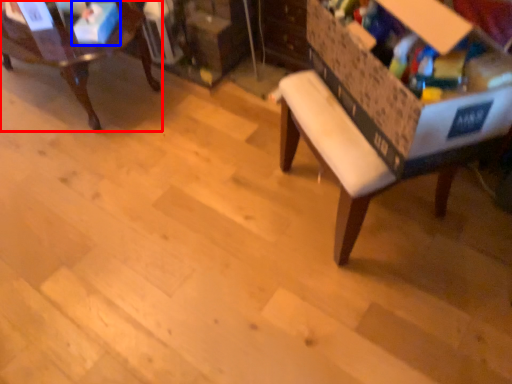
Question: Which object is closer to the camera taking this photo, chair (highlighted by a red box) or storage box (highlighted by a blue box)?

Choices:
 (A) chair
 (B) storage box

Answer: (A)